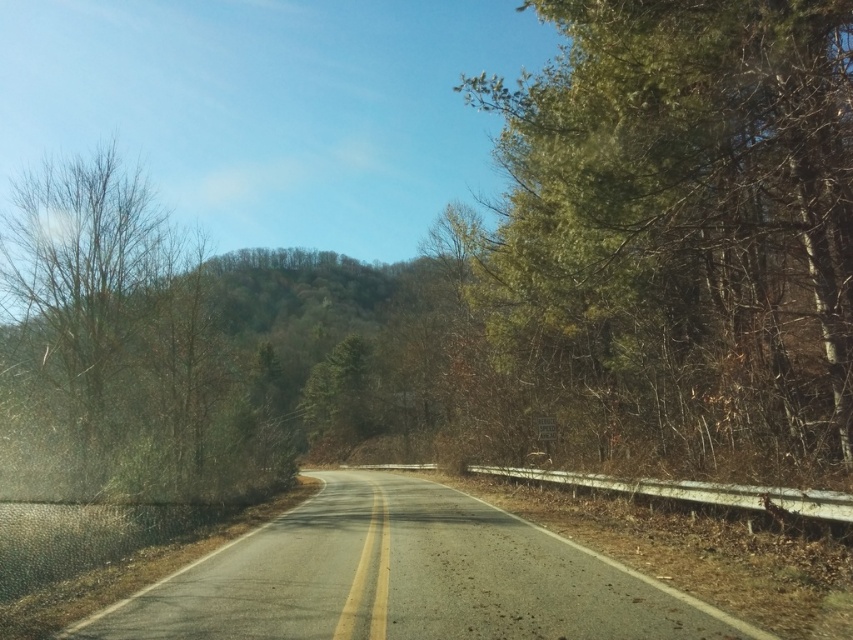
Question: Which of the following is the farthest from the observer?

Choices:
 (A) green leafy tree at right
 (B) asphalt road at center

Answer: (A)

Question: Can you confirm if asphalt road at center is positioned to the right of bare branches at left?

Choices:
 (A) no
 (B) yes

Answer: (B)

Question: Can you confirm if green leafy tree at right is wider than asphalt road at center?

Choices:
 (A) no
 (B) yes

Answer: (A)

Question: Which object appears farthest from the camera in this image?

Choices:
 (A) bare branches at left
 (B) asphalt road at center

Answer: (A)

Question: Which object is positioned closest to the green leafy tree at right?

Choices:
 (A) asphalt road at center
 (B) bare branches at left

Answer: (A)

Question: Is asphalt road at center above bare branches at left?

Choices:
 (A) yes
 (B) no

Answer: (B)